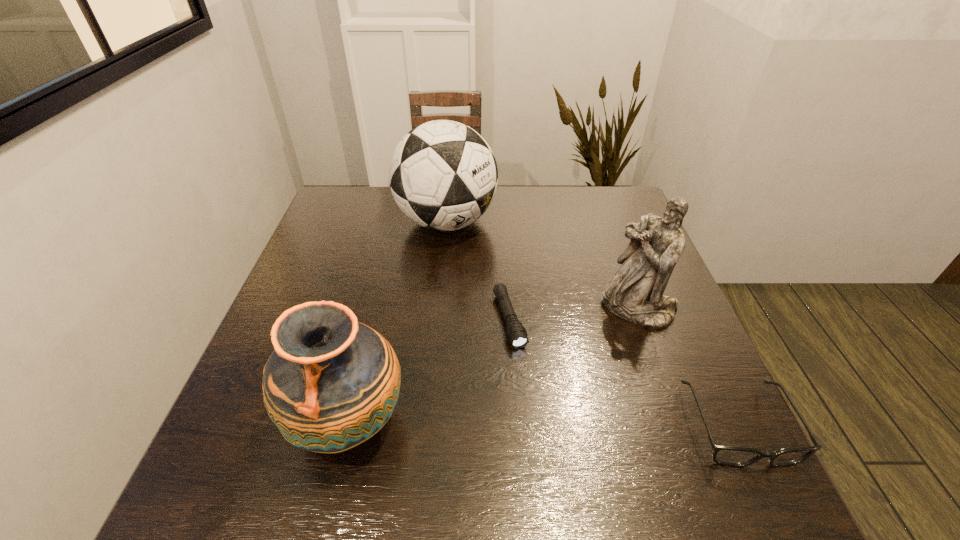
This screenshot has width=960, height=540. I want to click on free space on the desktop that is between the pottery and the spectacles and is positioned on the front-facing side of the figurine, so click(532, 423).

This screenshot has width=960, height=540. I want to click on free space on the desktop that is between the pottery and the spectacles and is positioned on the surface of the soccer ball where the brand logo is visible, so click(546, 423).

The width and height of the screenshot is (960, 540). Find the location of `free spot on the desktop that is between the pottery and the spectacles and is positioned at the lens end of the shortest object`. free spot on the desktop that is between the pottery and the spectacles and is positioned at the lens end of the shortest object is located at coordinates (548, 423).